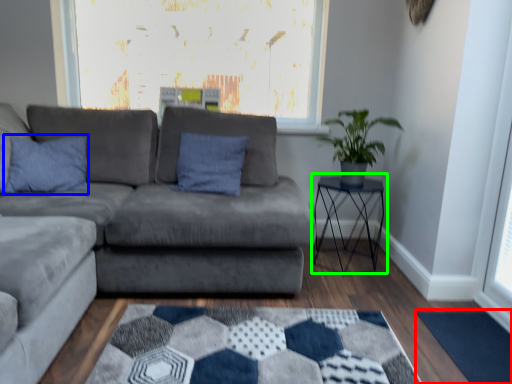
Question: Considering the real-world distances, which object is closest to mat (highlighted by a red box)? pillow (highlighted by a blue box) or table (highlighted by a green box).

Choices:
 (A) pillow
 (B) table

Answer: (B)